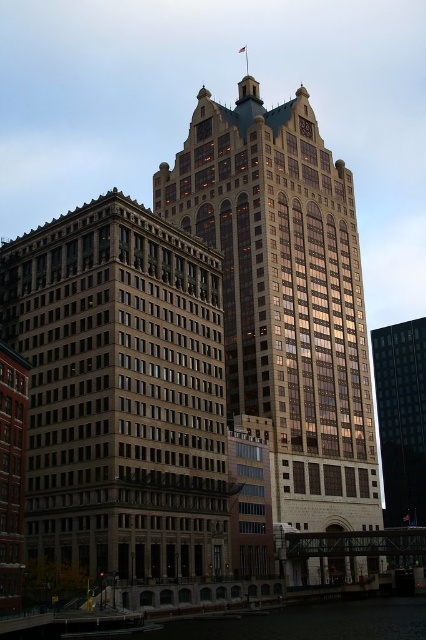
Question: Is brown stone building at center smaller than black glass building at right?

Choices:
 (A) yes
 (B) no

Answer: (B)

Question: In this image, where is gold glass skyscraper at center located relative to black glass building at right?

Choices:
 (A) below
 (B) above

Answer: (B)

Question: Considering the relative positions of gold glass skyscraper at center and black glass building at right in the image provided, where is gold glass skyscraper at center located with respect to black glass building at right?

Choices:
 (A) left
 (B) right

Answer: (A)

Question: Estimate the real-world distances between objects in this image. Which object is closer to the clear water at lower center?

Choices:
 (A) black glass building at right
 (B) brown stone building at center

Answer: (B)

Question: Which point is farther to the camera?

Choices:
 (A) clear water at lower center
 (B) brown stone building at center
 (C) gold glass skyscraper at center
 (D) black glass building at right

Answer: (D)

Question: Among these objects, which one is nearest to the camera?

Choices:
 (A) brown stone building at center
 (B) gold glass skyscraper at center

Answer: (A)